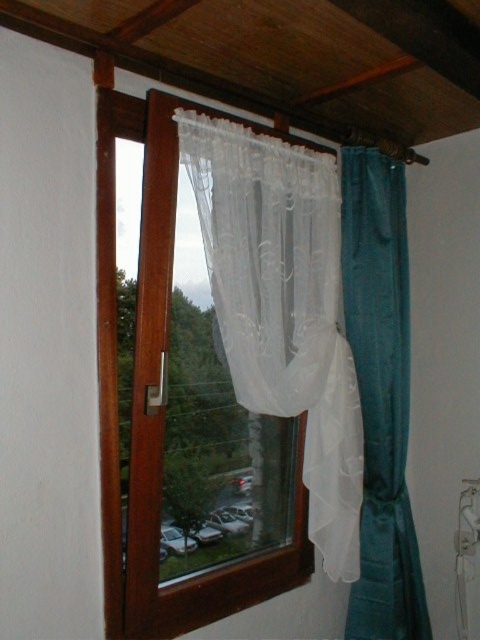
Question: Which point is farther to the camera?

Choices:
 (A) (193, 189)
 (B) (405, 493)

Answer: (B)

Question: Estimate the real-world distances between objects in this image. Which object is farther from the teal satin curtain at right?

Choices:
 (A) white sheer curtain at center
 (B) transparent plastic window at center

Answer: (B)

Question: Is white sheer curtain at center to the right of transparent plastic window at center from the viewer's perspective?

Choices:
 (A) yes
 (B) no

Answer: (A)

Question: Does white sheer curtain at center have a larger size compared to transparent plastic window at center?

Choices:
 (A) no
 (B) yes

Answer: (A)

Question: Which point is farther from the camera taking this photo?

Choices:
 (A) (348, 252)
 (B) (205, 179)

Answer: (A)

Question: Is white sheer curtain at center positioned at the back of teal satin curtain at right?

Choices:
 (A) no
 (B) yes

Answer: (A)